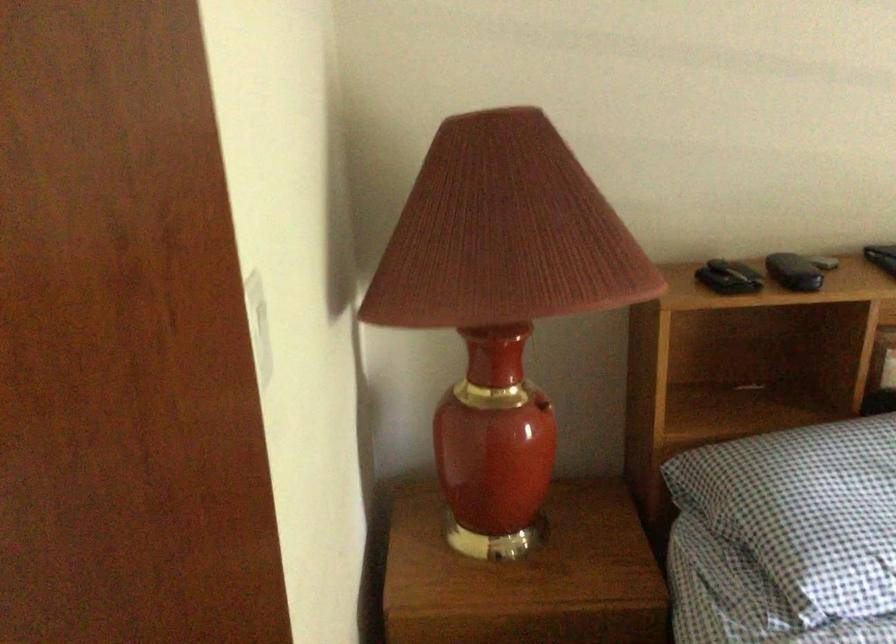
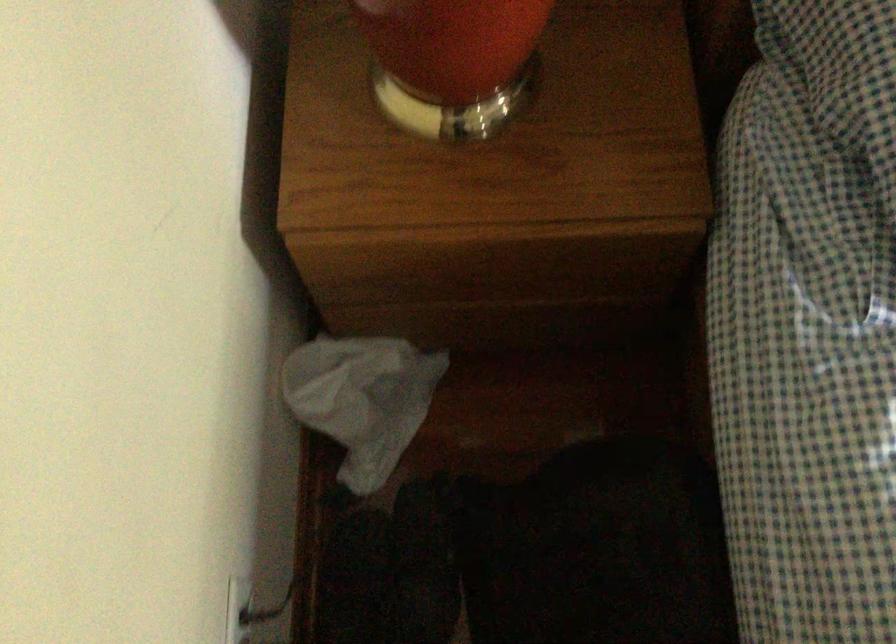
Question: The first image is from the beginning of the video and the second image is from the end. How did the camera likely rotate when shooting the video?

Choices:
 (A) Left
 (B) Right
 (C) Up
 (D) Down

Answer: (D)